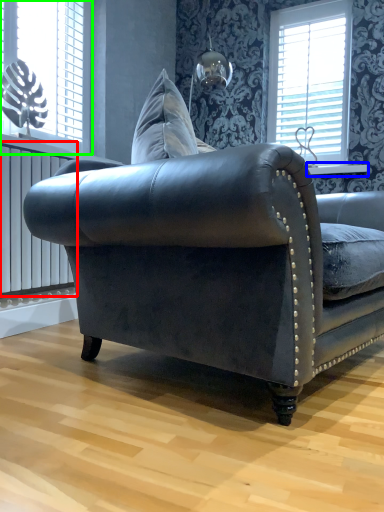
Question: Which is nearer to the radiator (highlighted by a red box)? window sill (highlighted by a blue box) or window (highlighted by a green box).

Choices:
 (A) window sill
 (B) window

Answer: (B)